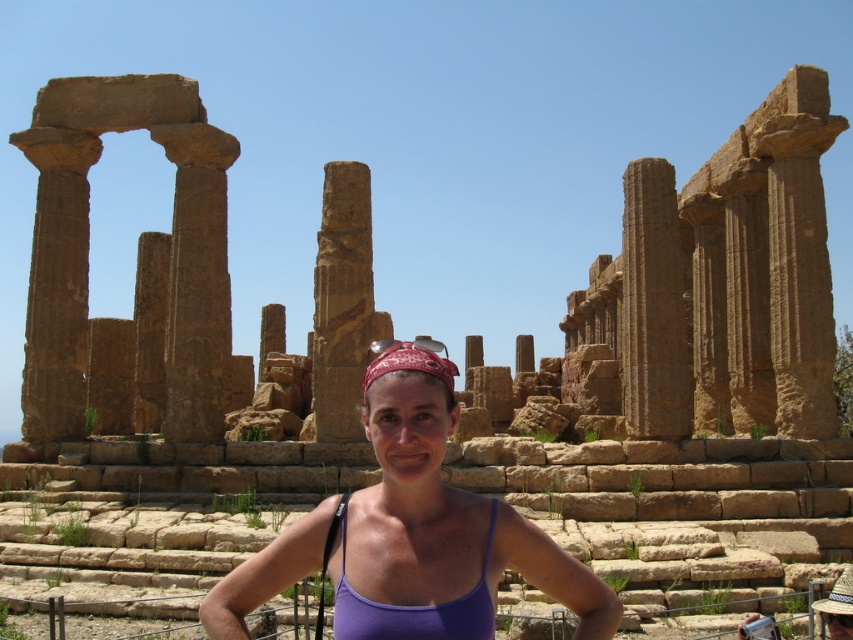
Which is more to the right, purple fabric at center or brown stone column at center?

purple fabric at center

Where is `purple fabric at center`? The width and height of the screenshot is (853, 640). purple fabric at center is located at coordinates (410, 541).

Does purple fabric at center have a greater width compared to red bandana at center?

Yes.

Looking at this image, is purple fabric at center to the right of red bandana at center from the viewer's perspective?

In fact, purple fabric at center is to the left of red bandana at center.

Does point (465, 624) lie in front of point (415, 349)?

Yes.

Where is `purple fabric at center`? purple fabric at center is located at coordinates (410, 541).

Between point (363, 298) and point (367, 387), which one is positioned in front?

Positioned in front is point (367, 387).

Who is positioned more to the left, brown stone column at center or red bandana at center?

brown stone column at center is more to the left.

Is point (349, 168) positioned after point (453, 372)?

That is True.

Locate an element on the screen. brown stone column at center is located at coordinates pos(341,301).